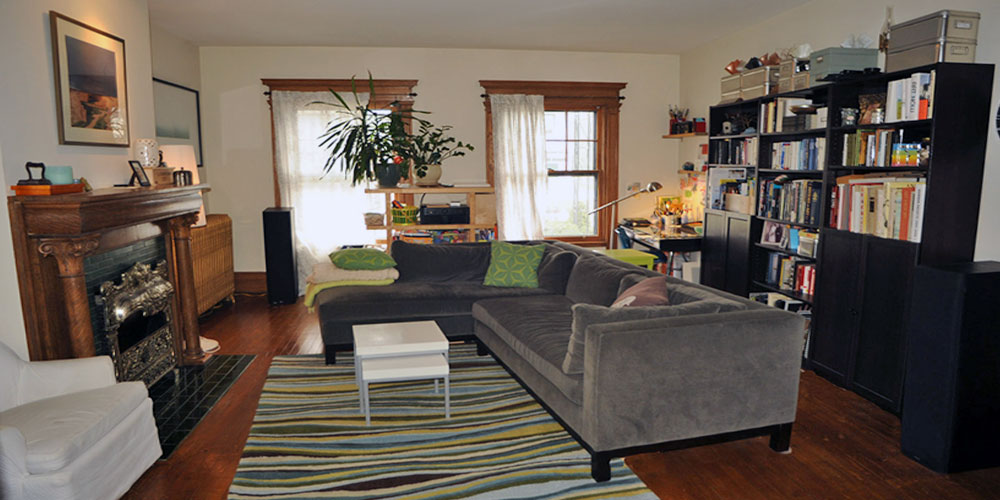
Locate an element on the screen. This screenshot has height=500, width=1000. picture frame is located at coordinates (56, 80).